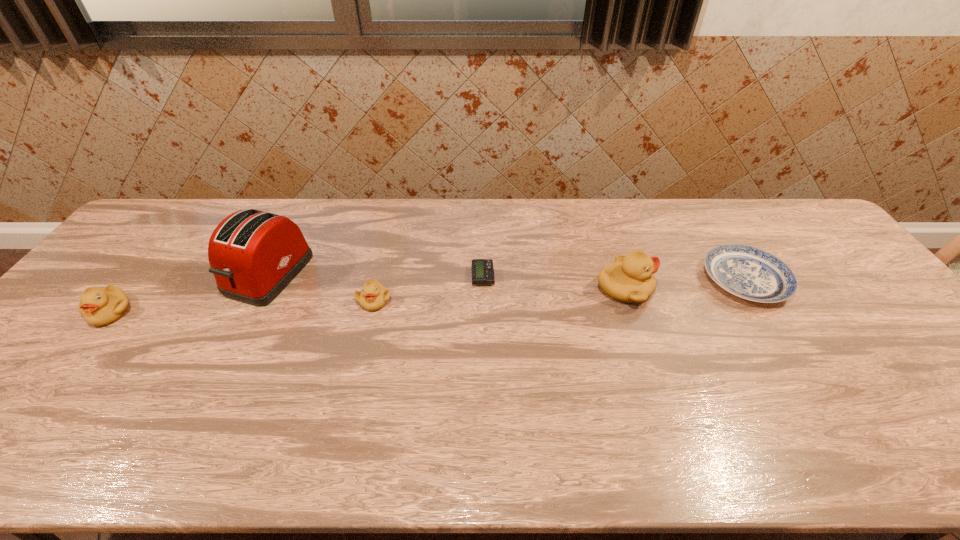
In the current image, all ducklings are evenly spaced. To maintain this equal spacing, where should an additional duckling be placed on the right? Please point out a free spot. Please provide its 2D coordinates. Your answer should be formatted as a tuple, i.e. [(x, y)], where the tuple contains the x and y coordinates of a point satisfying the conditions above.

[(862, 279)]